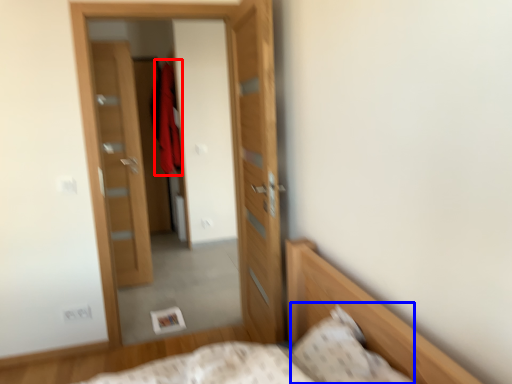
Question: Which point is closer to the camera, robe (highlighted by a red box) or pillow (highlighted by a blue box)?

Choices:
 (A) robe
 (B) pillow

Answer: (B)